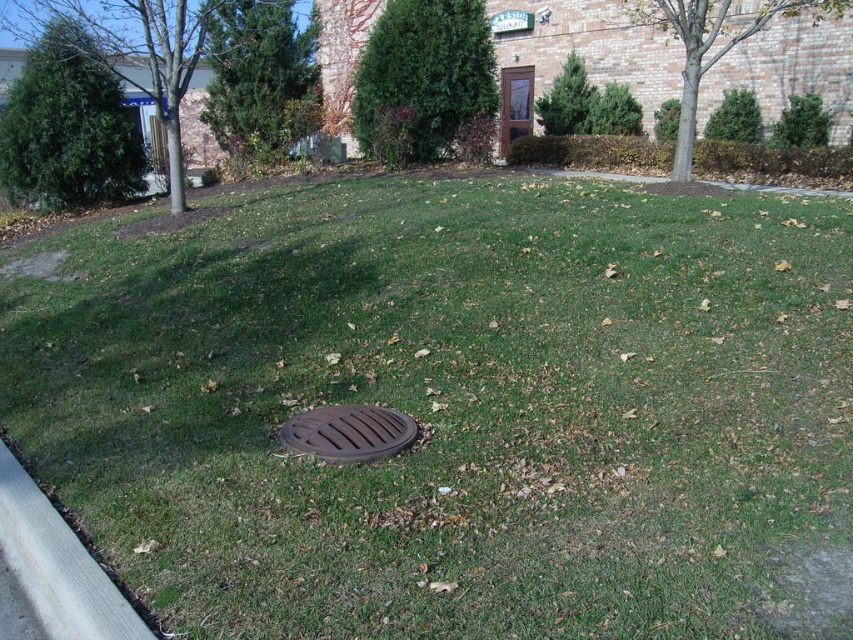
You are a maintenance worker who needs to access the brown matte manhole cover at center. You see the green grass at center in the way. Is the manhole cover accessible without moving the grass?

The green grass at center is located above the brown matte manhole cover at center, so you would need to move the grass to access the manhole cover.

You are a gardener who needs to mow the lawn. You see the green grass at center and the gray concrete curb at lower left. Which area should you avoid mowing to prevent damaging equipment?

You should avoid mowing the gray concrete curb at lower left because the green grass at center is taller than the gray concrete curb at lower left, meaning the curb is lower and made of concrete, which could damage the mower blades if run over.